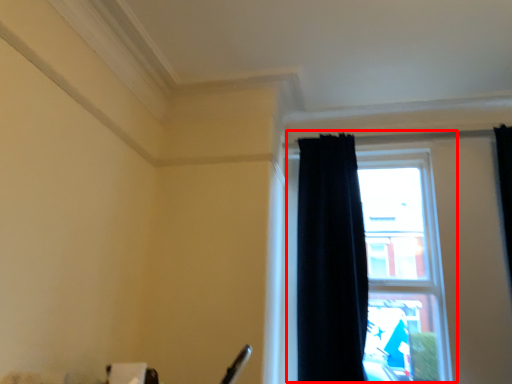
Question: From the image's perspective, considering the relative positions of window (annotated by the red box) and curtain in the image provided, where is window (annotated by the red box) located with respect to the staircase?

Choices:
 (A) below
 (B) above

Answer: (A)